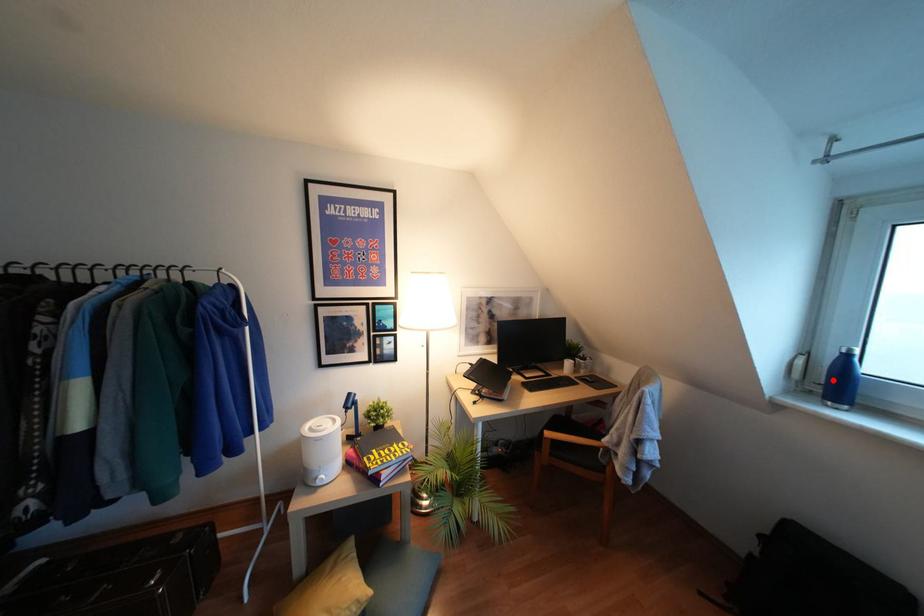
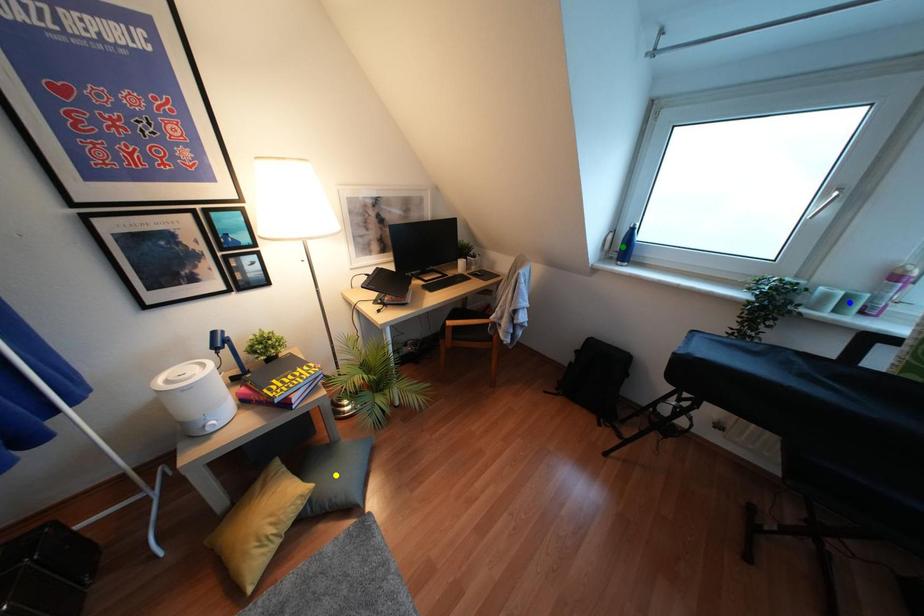
Question: I am providing you with two images of the same scene from different viewpoints. A red point is marked on the first image. You are given multiple points on the second image. Which point in image 2 is actually the same real-world point as the red point in image 1?

Choices:
 (A) green point
 (B) blue point
 (C) yellow point

Answer: (A)